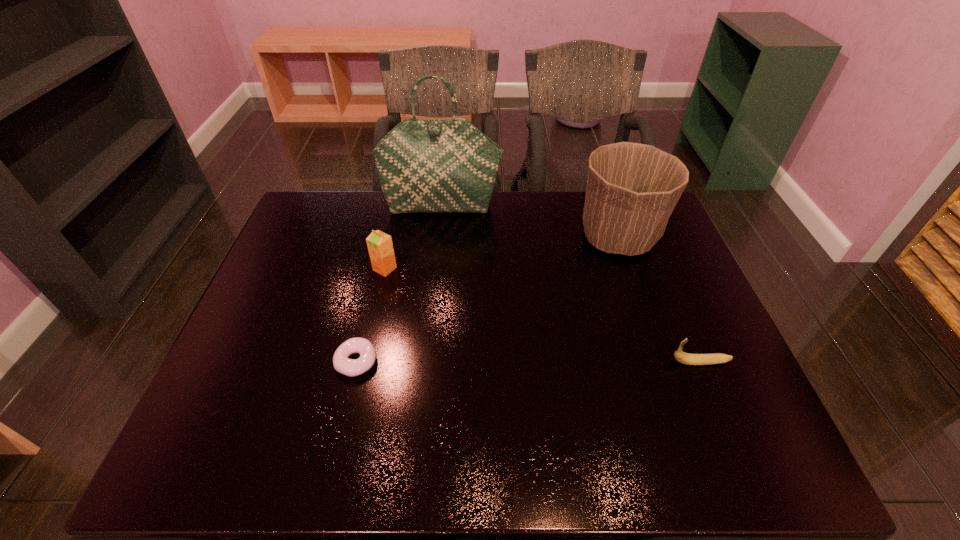
The height and width of the screenshot is (540, 960). What are the coordinates of `vacant space at the near left corner` in the screenshot? It's located at (180, 462).

Find the location of `unoccupied area between the banana and the shortest object`. unoccupied area between the banana and the shortest object is located at coordinates (528, 362).

At what (x,y) coordinates should I click in order to perform the action: click on free space between the tote bag and the shortest object. Please return your answer as a coordinate pair (x, y). The image size is (960, 540). Looking at the image, I should click on (399, 284).

This screenshot has height=540, width=960. Find the location of `empty location between the fourth shortest object and the tote bag`. empty location between the fourth shortest object and the tote bag is located at coordinates (530, 222).

Find the location of a particular element. vacant area that lies between the second shortest object and the shortest object is located at coordinates (528, 362).

Find the location of `empty location between the banana and the flowerpot`. empty location between the banana and the flowerpot is located at coordinates (660, 300).

The width and height of the screenshot is (960, 540). I want to click on vacant area that lies between the fourth shortest object and the banana, so click(660, 300).

The height and width of the screenshot is (540, 960). What are the coordinates of `free space that is in between the banana and the third tallest object` in the screenshot? It's located at (542, 315).

Where is `unoccupied position between the fourth tallest object and the shortest object`? The height and width of the screenshot is (540, 960). unoccupied position between the fourth tallest object and the shortest object is located at coordinates (528, 362).

Identify the location of unoccupied position between the orange juice and the shortest object. The image size is (960, 540). (371, 315).